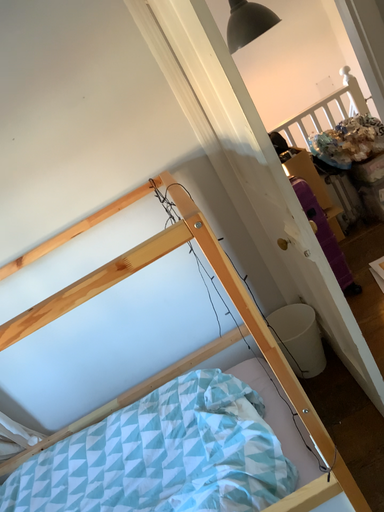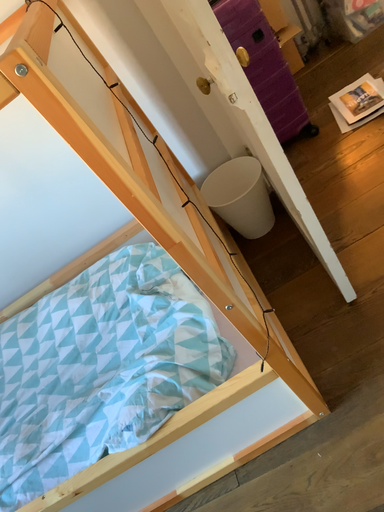
Question: Which way did the camera rotate in the video?

Choices:
 (A) rotated downward
 (B) rotated upward

Answer: (A)